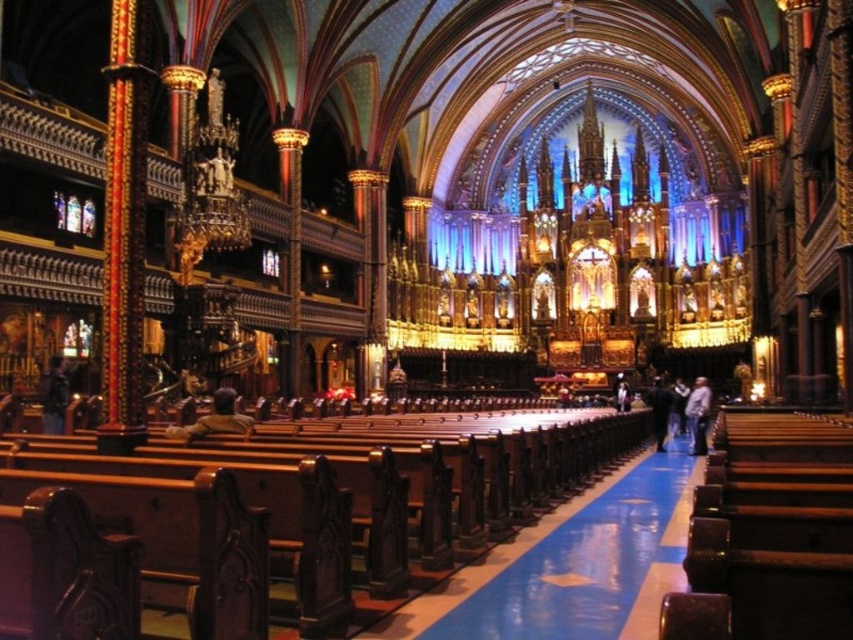
Question: Which object is farther from the camera taking this photo?

Choices:
 (A) blue glossy aisle at center
 (B) leather jacket at center
 (C) light gray fabric jacket at center
 (D) dark brown leather jacket at center

Answer: (D)

Question: Does blue glossy aisle at center appear on the left side of dark brown leather jacket at left?

Choices:
 (A) yes
 (B) no

Answer: (B)

Question: In this image, where is dark brown leather jacket at left located relative to light gray fabric jacket at center?

Choices:
 (A) right
 (B) left

Answer: (B)

Question: Is blue glossy aisle at center above leather jacket at center?

Choices:
 (A) no
 (B) yes

Answer: (A)

Question: Which object appears closest to the camera in this image?

Choices:
 (A) light gray fabric jacket at center
 (B) leather jacket at center
 (C) dark brown leather jacket at center
 (D) blue glossy aisle at center

Answer: (D)

Question: Among these points, which one is nearest to the camera?

Choices:
 (A) (654, 385)
 (B) (53, 369)
 (C) (461, 570)

Answer: (C)